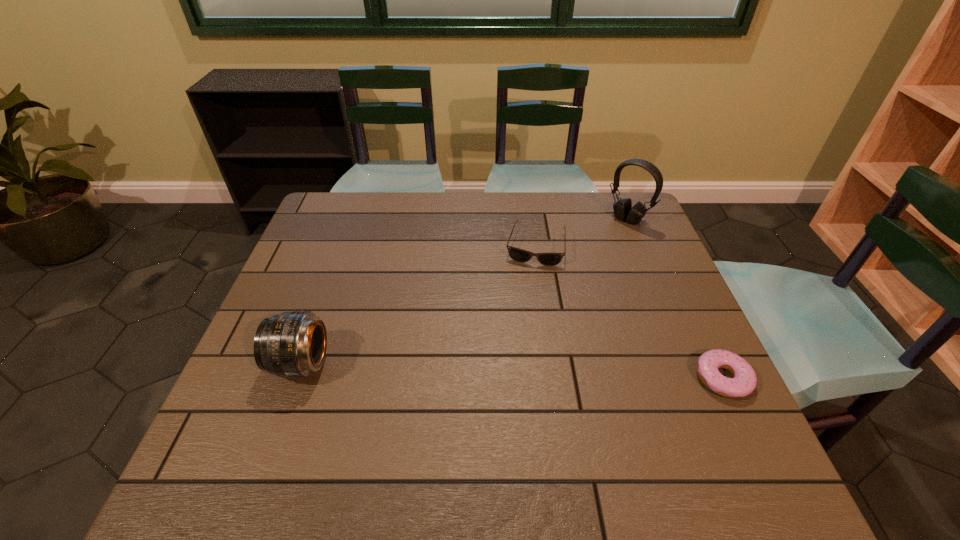
In order to click on vacant area located 0.310m on the lenses of the third tallest object in this screenshot , I will do `click(515, 353)`.

The width and height of the screenshot is (960, 540). In order to click on free space located 0.080m on the lenses of the third tallest object in this screenshot , I will do `click(528, 285)`.

You are a GUI agent. You are given a task and a screenshot of the screen. Output one action in this format:
    pyautogui.click(x=<x>, y=<y>)
    Task: Click on the vacant area located 0.340m on the front-facing side of the tallest object
    Image resolution: width=960 pixels, height=540 pixels.
    Given the screenshot: What is the action you would take?
    pyautogui.click(x=558, y=286)

This screenshot has height=540, width=960. Identify the location of vacant space located 0.050m on the front-facing side of the tallest object. (610, 235).

Image resolution: width=960 pixels, height=540 pixels. I want to click on vacant space situated on the front-facing side of the tallest object, so click(560, 284).

You are a GUI agent. You are given a task and a screenshot of the screen. Output one action in this format:
    pyautogui.click(x=<x>, y=<y>)
    Task: Click on the sunglasses located in the far edge section of the desktop
    
    Given the screenshot: What is the action you would take?
    pyautogui.click(x=547, y=259)

Locate an element on the screen. The height and width of the screenshot is (540, 960). headset positioned at the far edge is located at coordinates (623, 210).

At what (x,y) coordinates should I click in order to perform the action: click on object located at the near edge. Please return your answer as a coordinate pair (x, y). The height and width of the screenshot is (540, 960). Looking at the image, I should click on (744, 382).

The width and height of the screenshot is (960, 540). Find the location of `object situated at the left edge`. object situated at the left edge is located at coordinates (292, 344).

Find the location of a particular element. This screenshot has width=960, height=540. doughnut located in the right edge section of the desktop is located at coordinates (744, 382).